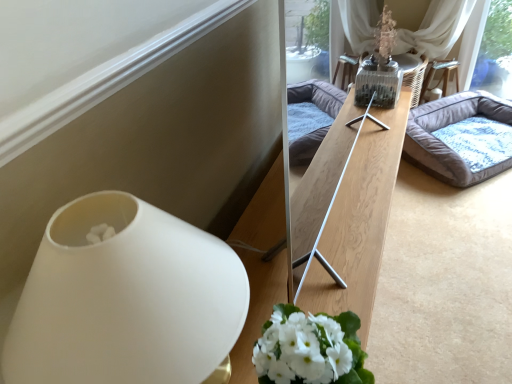
Question: From the image's perspective, is gray fabric pet bed at center located above or below white matte vase at lower left?

Choices:
 (A) above
 (B) below

Answer: (A)

Question: Considering the relative positions of gray fabric pet bed at center and white matte vase at lower left in the image provided, is gray fabric pet bed at center to the left or to the right of white matte vase at lower left?

Choices:
 (A) right
 (B) left

Answer: (A)

Question: In terms of height, does gray fabric pet bed at center look taller or shorter compared to white matte vase at lower left?

Choices:
 (A) tall
 (B) short

Answer: (B)

Question: Looking at their shapes, would you say white matte vase at lower left is wider or thinner than gray fabric pet bed at center?

Choices:
 (A) wide
 (B) thin

Answer: (B)

Question: Is white matte vase at lower left in front of or behind gray fabric pet bed at center in the image?

Choices:
 (A) front
 (B) behind

Answer: (A)

Question: Is white matte vase at lower left bigger or smaller than gray fabric pet bed at center?

Choices:
 (A) big
 (B) small

Answer: (B)

Question: Is point (238, 268) positioned closer to the camera than point (439, 177)?

Choices:
 (A) closer
 (B) farther

Answer: (A)